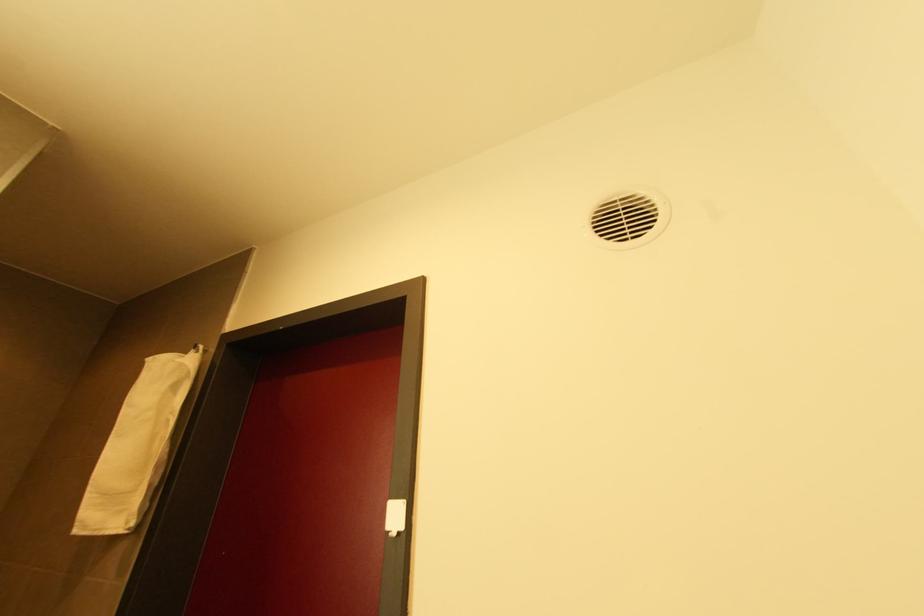
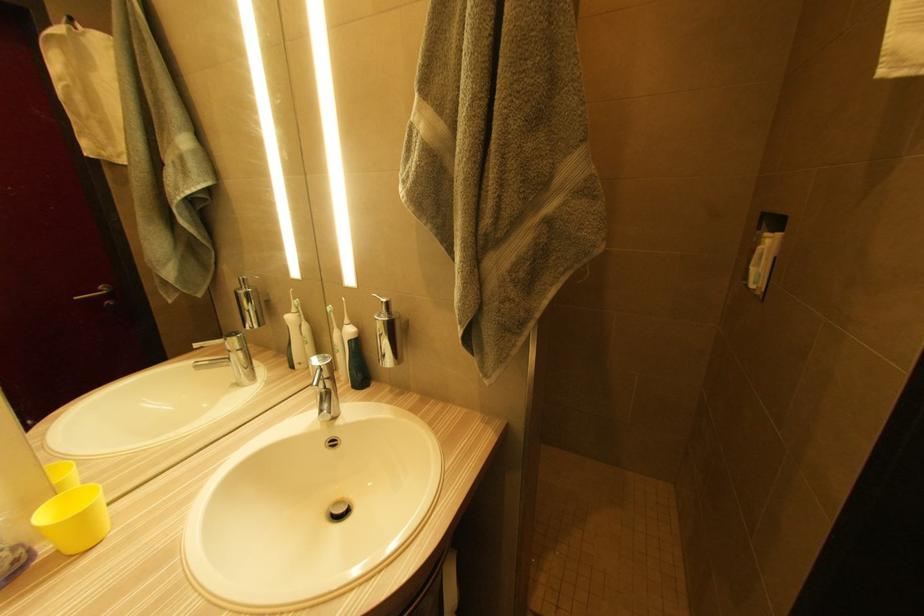
The first image is from the beginning of the video and the second image is from the end. How did the camera likely rotate when shooting the video?

The camera's rotation is toward left-down.